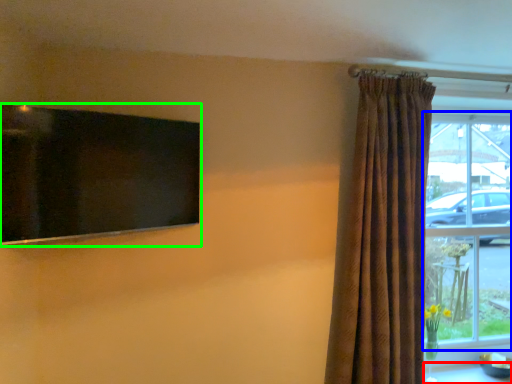
Question: Which object is positioned farthest from table (highlighted by a red box)? Select from window (highlighted by a blue box) and window screen (highlighted by a green box).

Choices:
 (A) window
 (B) window screen

Answer: (B)